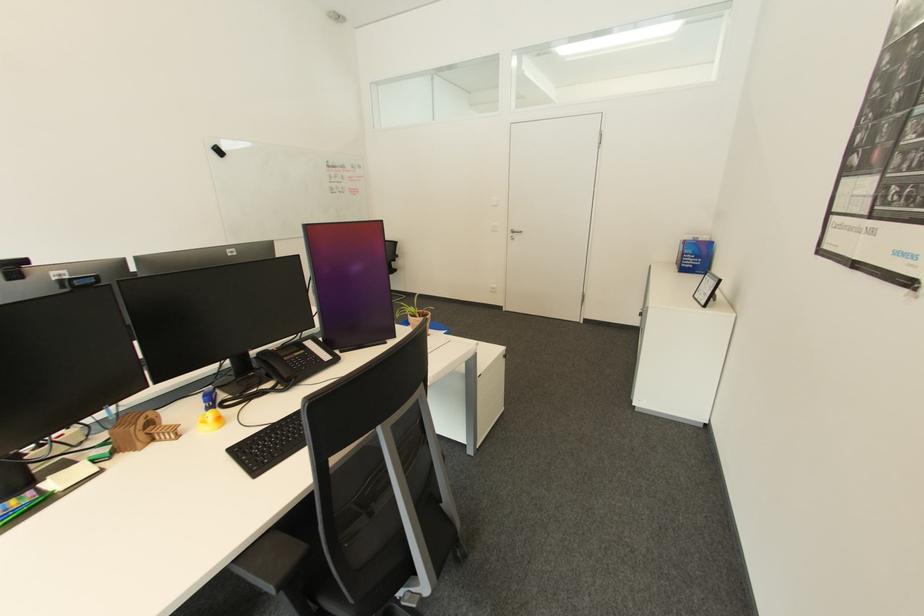
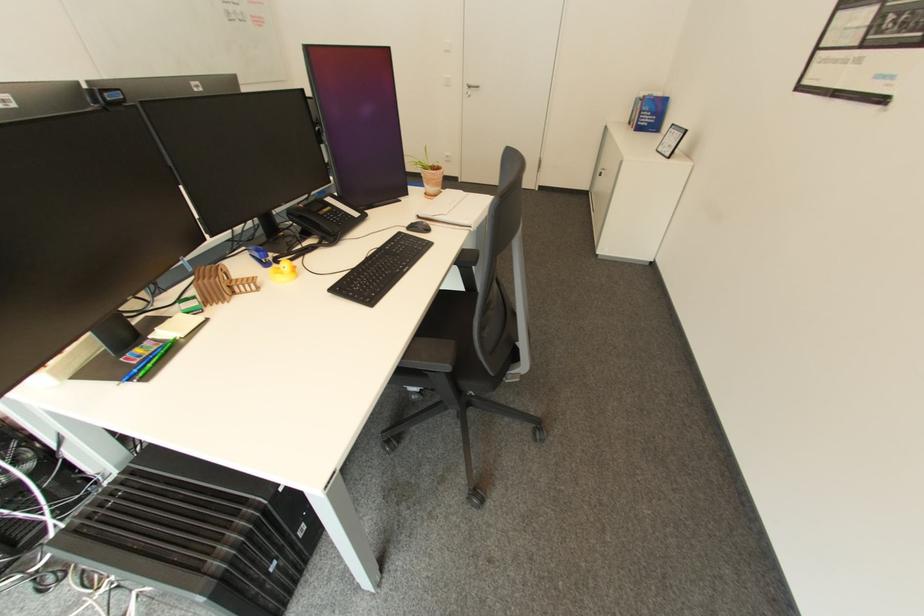
Question: Which direction would the cameraman need to move to produce the second image? Reply with the corresponding letter.

Choices:
 (A) Left
 (B) Right
 (C) Forward
 (D) Backward

Answer: (A)